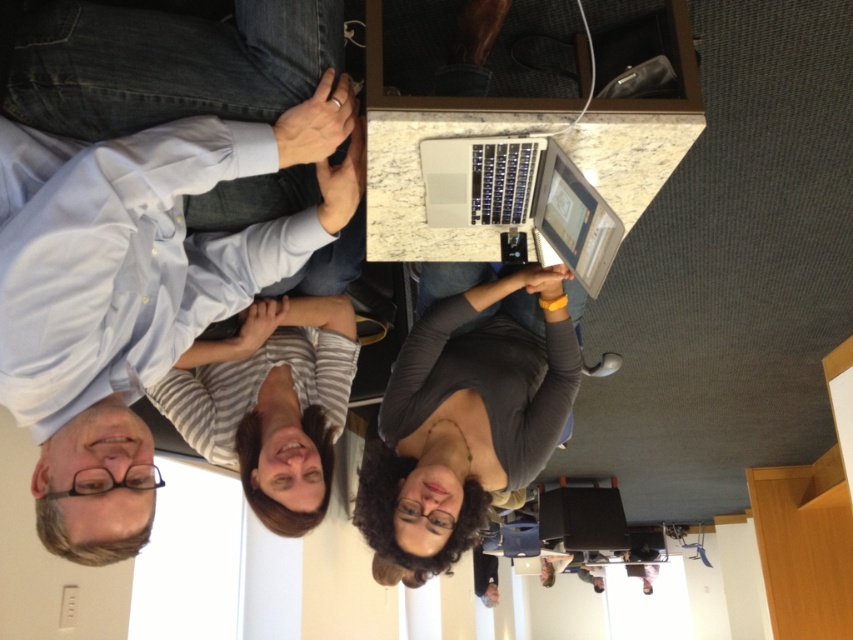
Question: Does light blue shirt at upper left appear under sleek silver laptop at center?

Choices:
 (A) no
 (B) yes

Answer: (B)

Question: Does sleek silver laptop at center have a smaller size compared to silver metallic laptop at center?

Choices:
 (A) yes
 (B) no

Answer: (A)

Question: Which of the following is the farthest from the observer?

Choices:
 (A) (175, 310)
 (B) (413, 451)
 (C) (422, 144)

Answer: (B)

Question: Which point is closer to the camera?

Choices:
 (A) striped fabric shirt at center
 (B) gray matte shirt at center
 (C) light blue shirt at upper left

Answer: (C)

Question: Which of the following is the farthest from the observer?

Choices:
 (A) (111, 305)
 (B) (395, 372)
 (C) (543, 172)
 (D) (347, 381)

Answer: (B)

Question: Observing the image, what is the correct spatial positioning of light blue shirt at upper left in reference to silver metallic laptop at center?

Choices:
 (A) right
 (B) left

Answer: (B)